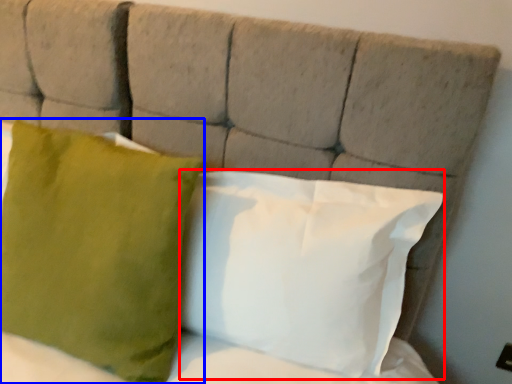
Question: Which object appears farthest to the camera in this image, pillow (highlighted by a red box) or pillow (highlighted by a blue box)?

Choices:
 (A) pillow
 (B) pillow

Answer: (A)